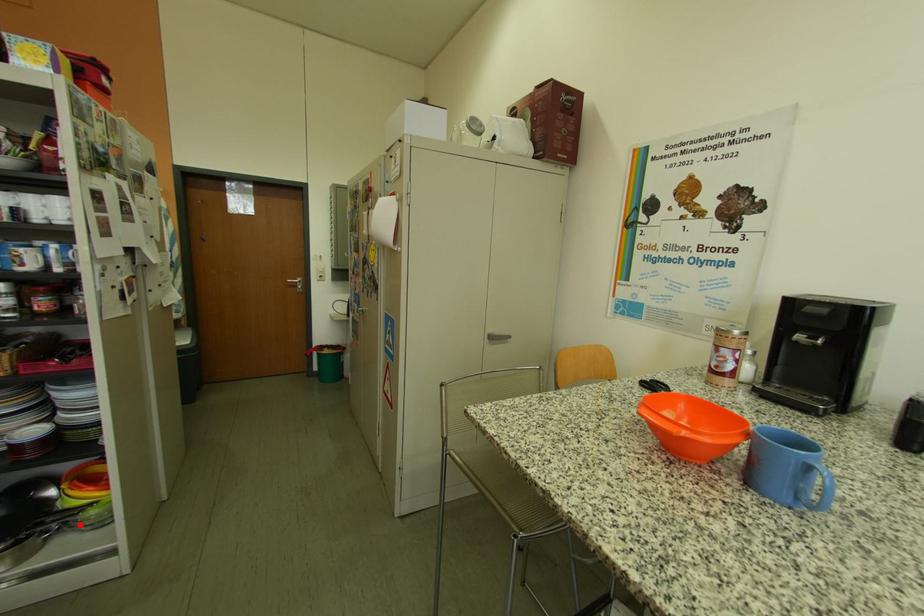
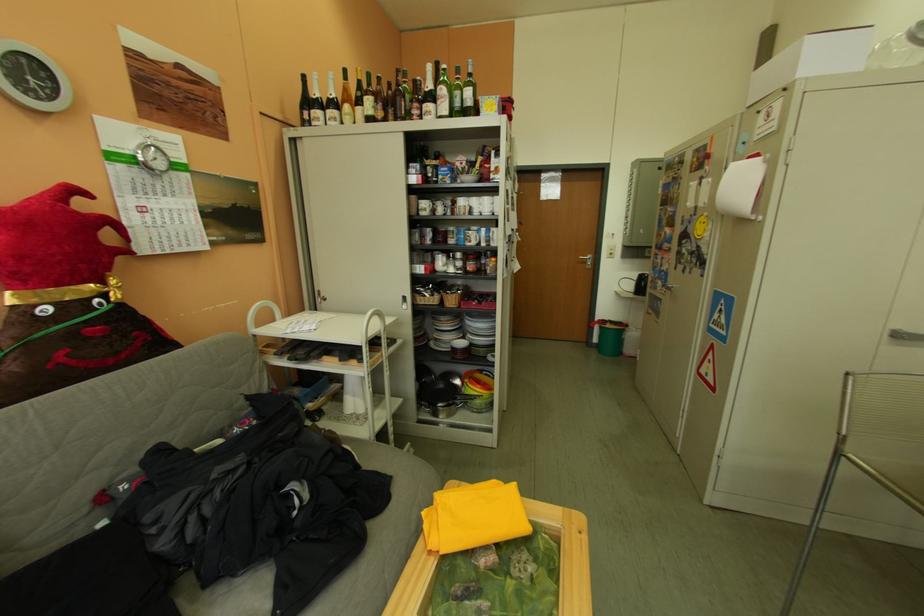
Question: I am providing you with two images of the same scene from different viewpoints. Image1 has a red point marked. In image2, the corresponding 3D location appears at what relative position? Reply with the corresponding letter.

Choices:
 (A) Closer
 (B) Farther

Answer: (B)